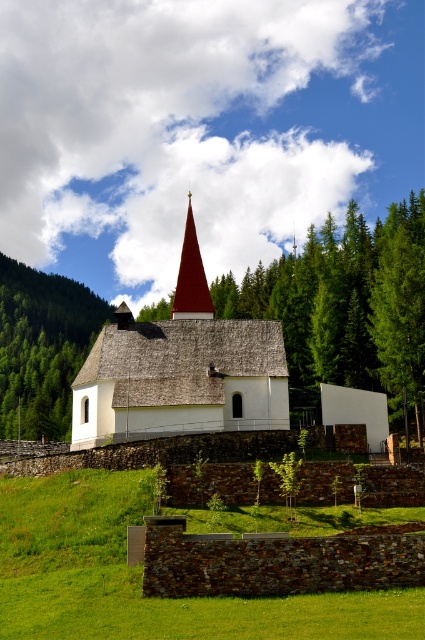
Question: Does green textured tree at right appear on the left side of smooth red spire at center?

Choices:
 (A) yes
 (B) no

Answer: (B)

Question: Does green textured tree at right lie in front of smooth red spire at center?

Choices:
 (A) no
 (B) yes

Answer: (B)

Question: Can you confirm if green grass at lower center is thinner than green textured tree at right?

Choices:
 (A) no
 (B) yes

Answer: (A)

Question: Which object is positioned closest to the matte red roof at center?

Choices:
 (A) smooth red spire at center
 (B) green grass at lower center
 (C) green textured tree at right
 (D) green leafy tree at upper left

Answer: (A)

Question: Which of the following is the farthest from the observer?

Choices:
 (A) (396, 364)
 (B) (172, 316)

Answer: (A)

Question: Which object is the farthest from the green leafy tree at upper left?

Choices:
 (A) green grass at lower center
 (B) matte red roof at center
 (C) green textured tree at right
 (D) smooth red spire at center

Answer: (A)